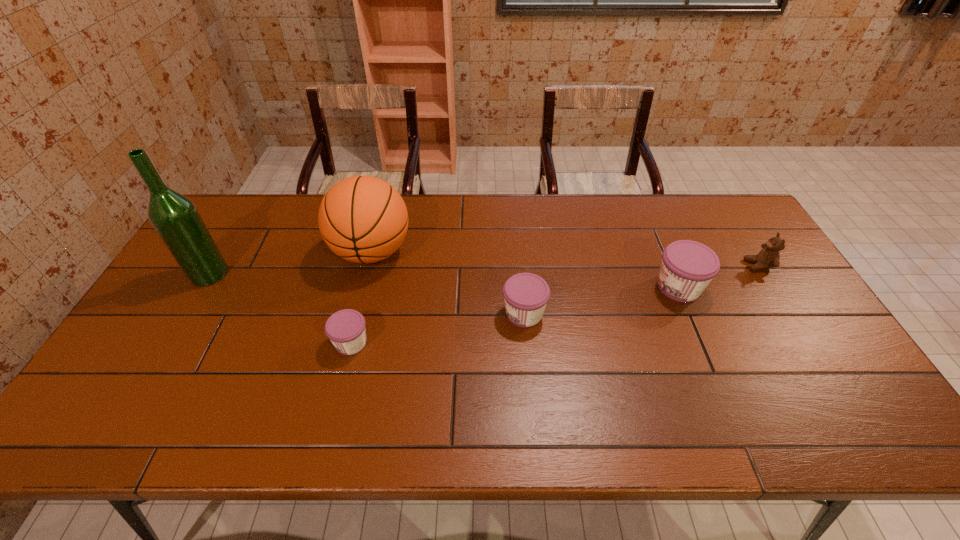
Where is `free space located on the front label of the shortest object`? This screenshot has width=960, height=540. free space located on the front label of the shortest object is located at coordinates (235, 343).

Image resolution: width=960 pixels, height=540 pixels. Identify the location of free location located 0.220m on the front label of the shortest object. (247, 343).

Find the location of a particular element. The width and height of the screenshot is (960, 540). free location located 0.370m on the front label of the shortest object is located at coordinates (189, 343).

At what (x,y) coordinates should I click in order to perform the action: click on free location located on the front label of the third object from right to left. Please return your answer as a coordinate pair (x, y). Looking at the image, I should click on (432, 313).

Where is `vacant space located on the front label of the third object from right to left`? vacant space located on the front label of the third object from right to left is located at coordinates (465, 313).

Locate an element on the screen. This screenshot has height=540, width=960. free space located 0.310m on the front label of the third object from right to left is located at coordinates (389, 313).

Where is `vacant region located 0.290m on the front label of the second object from right to left`? vacant region located 0.290m on the front label of the second object from right to left is located at coordinates point(553,287).

The width and height of the screenshot is (960, 540). Identify the location of free space located on the front label of the second object from right to left. (618, 287).

I want to click on blank space located 0.200m on the front label of the second object from right to left, so click(x=584, y=287).

Where is `free point located on the back of the tallest object`? free point located on the back of the tallest object is located at coordinates (235, 230).